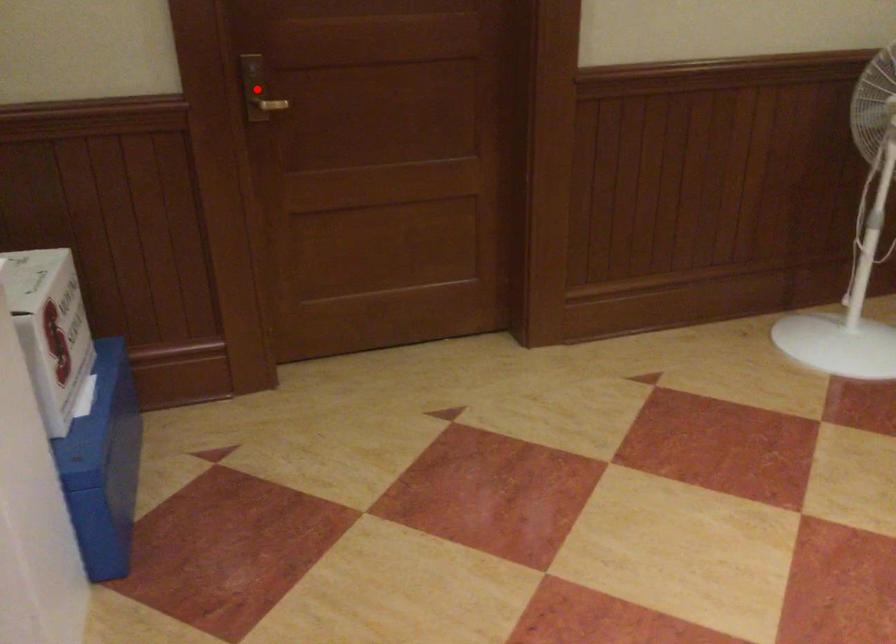
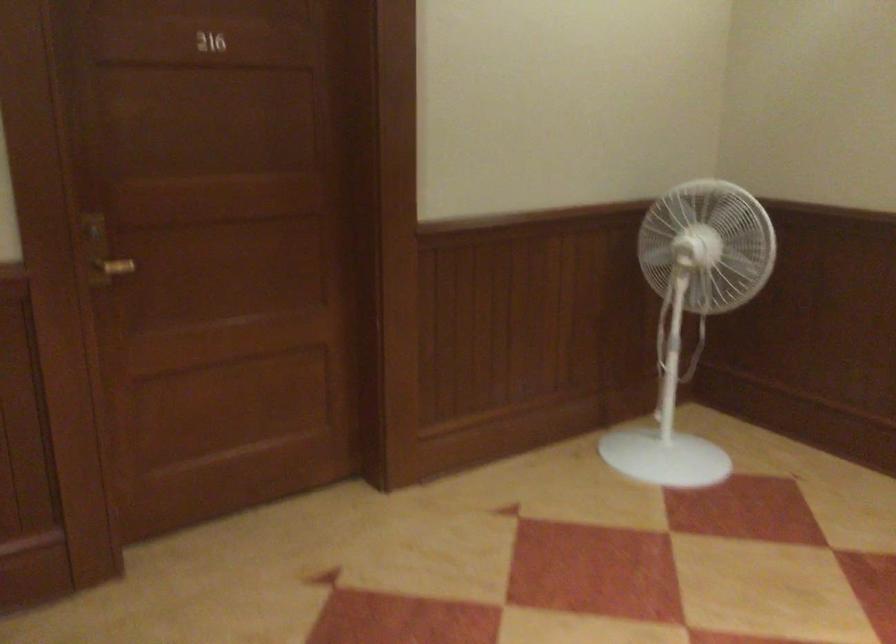
Locate, in the second image, the point that corresponds to the highlighted location in the first image.

(101, 252)